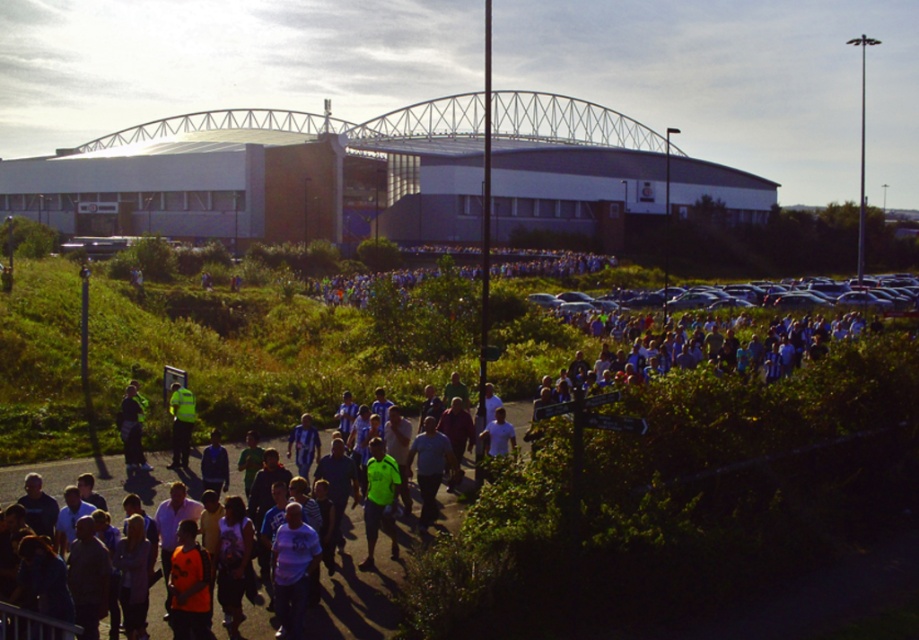
Which of these two, neon green jersey at center or high visibility jacket at center, stands taller?

neon green jersey at center is taller.

Is point (389, 460) positioned before point (171, 403)?

That is True.

At what (x,y) coordinates should I click in order to perform the action: click on neon green jersey at center. Please return your answer as a coordinate pair (x, y). This screenshot has height=640, width=919. Looking at the image, I should click on (379, 499).

Is gray metallic stadium at upper center thinner than high visibility jacket at center?

Incorrect, gray metallic stadium at upper center's width is not less than high visibility jacket at center's.

Does gray metallic stadium at upper center have a larger size compared to high visibility jacket at center?

Indeed, gray metallic stadium at upper center has a larger size compared to high visibility jacket at center.

Image resolution: width=919 pixels, height=640 pixels. Find the location of `gray metallic stadium at upper center`. gray metallic stadium at upper center is located at coordinates (267, 177).

You are a GUI agent. You are given a task and a screenshot of the screen. Output one action in this format:
    pyautogui.click(x=<x>, y=<y>)
    Task: Click on the gray metallic stadium at upper center
    
    Given the screenshot: What is the action you would take?
    pyautogui.click(x=267, y=177)

Is blue striped shirts at center thinner than neon green jersey at center?

Incorrect, blue striped shirts at center's width is not less than neon green jersey at center's.

Is point (614, 556) positioned in front of point (371, 488)?

That is True.

At what (x,y) coordinates should I click in order to perform the action: click on blue striped shirts at center. Please return your answer as a coordinate pair (x, y). Looking at the image, I should click on (745, 468).